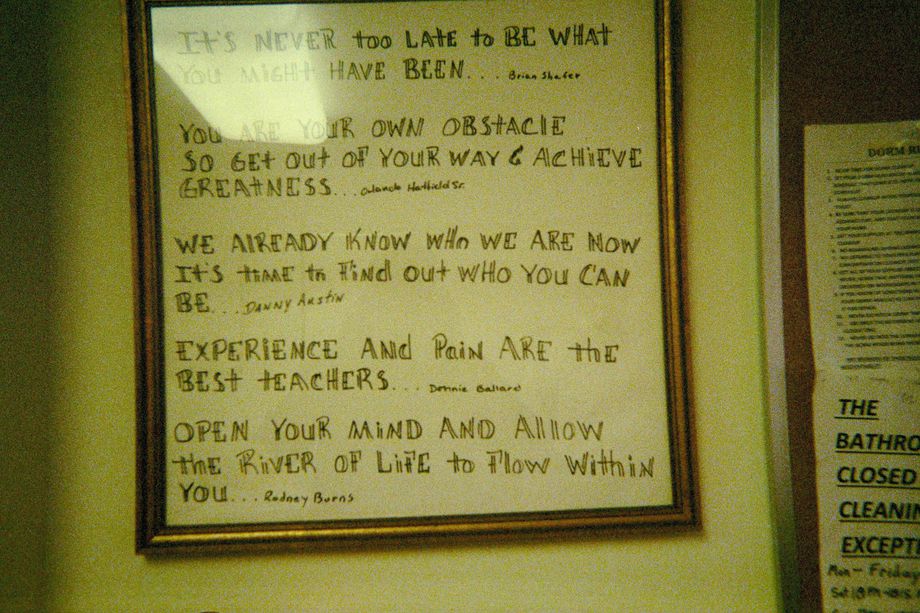
The image size is (920, 613). What are the coordinates of `silver border of board` in the screenshot? It's located at (772, 265), (776, 515), (761, 75).